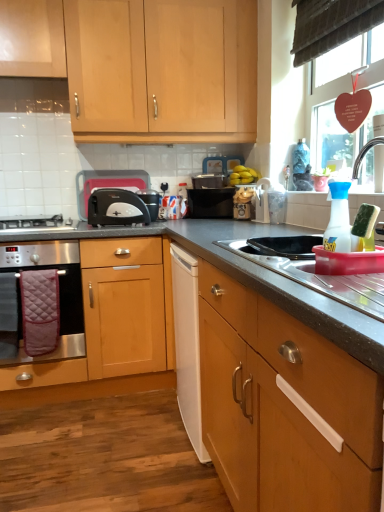
Identify the location of free space to the left of transparent plastic spray bottle at right, placed as the 2th appliance when sorted from front to back. This screenshot has width=384, height=512. (268, 263).